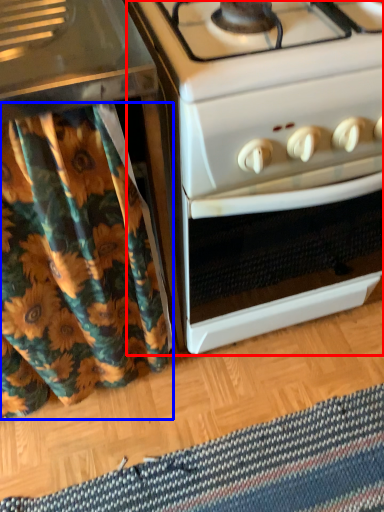
Question: Among these objects, which one is farthest to the camera, oven (highlighted by a red box) or shower curtain (highlighted by a blue box)?

Choices:
 (A) oven
 (B) shower curtain

Answer: (A)